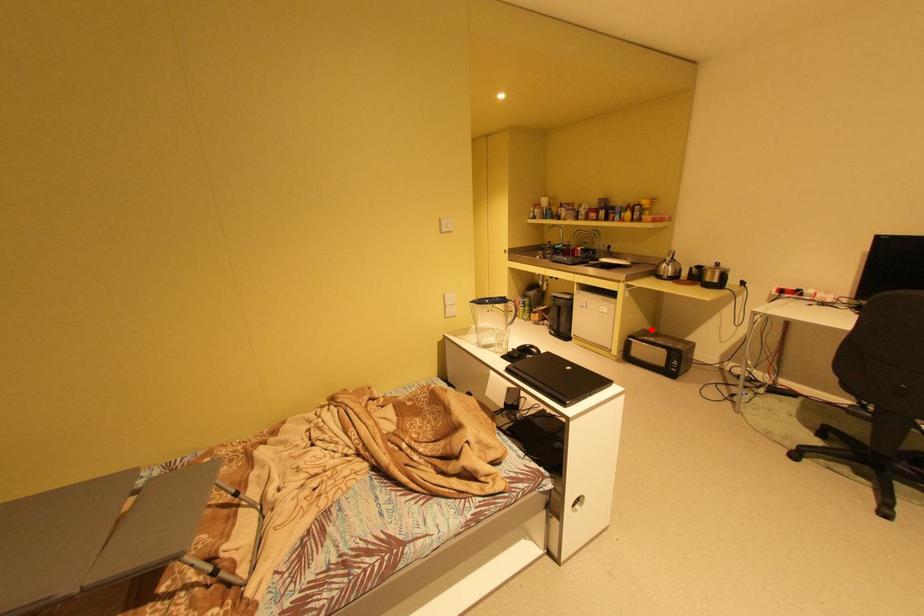
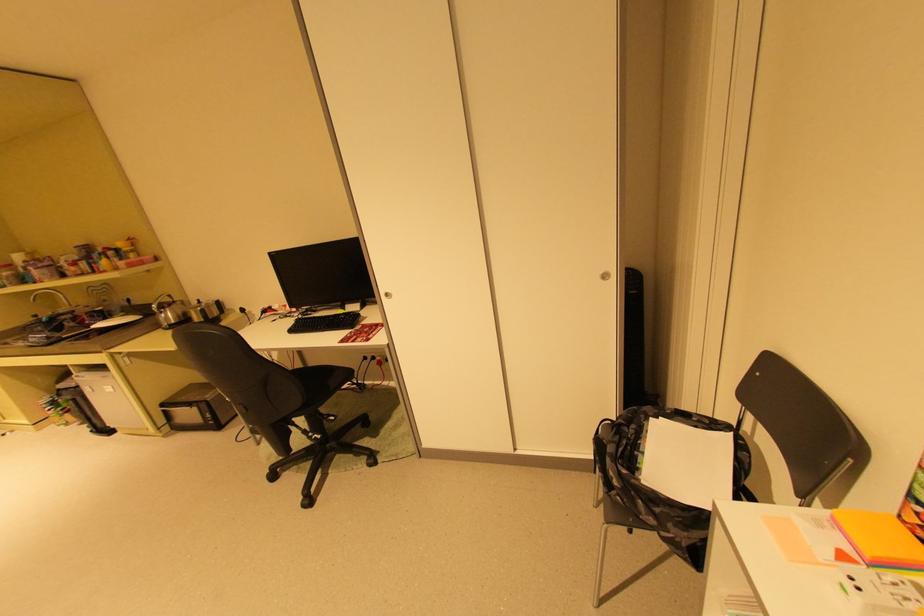
Where in the second image is the point corresponding to the highlighted location from the first image?

(199, 385)